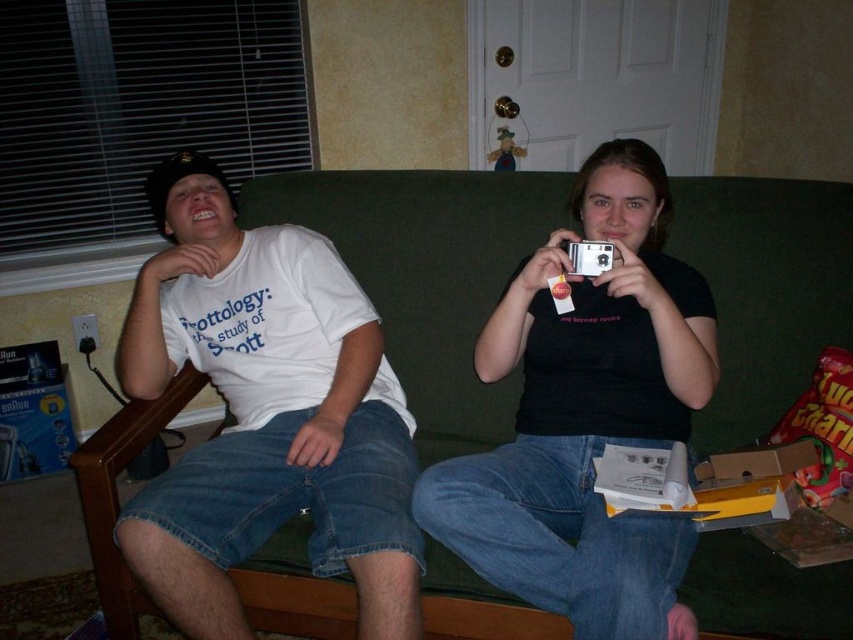
Is green fabric couch at center positioned in front of white matte t-shirt at left?

No, it is behind white matte t-shirt at left.

Between green fabric couch at center and white matte t-shirt at left, which one appears on the left side from the viewer's perspective?

white matte t-shirt at left is more to the left.

This screenshot has height=640, width=853. What do you see at coordinates (427, 275) in the screenshot? I see `green fabric couch at center` at bounding box center [427, 275].

Identify the location of green fabric couch at center. The image size is (853, 640). (427, 275).

Can you confirm if green fabric couch at center is wider than black matte camera at center?

Yes.

Is green fabric couch at center smaller than black matte camera at center?

Indeed, green fabric couch at center has a smaller size compared to black matte camera at center.

Is point (434, 227) farther from viewer compared to point (498, 460)?

Yes, point (434, 227) is farther from viewer.

Where is `green fabric couch at center`? This screenshot has width=853, height=640. green fabric couch at center is located at coordinates (x=427, y=275).

Is white matte t-shirt at left taller than black matte camera at center?

Yes, white matte t-shirt at left is taller than black matte camera at center.

Between white matte t-shirt at left and black matte camera at center, which one appears on the right side from the viewer's perspective?

Positioned to the right is black matte camera at center.

Is point (408, 445) positioned before point (508, 291)?

Yes, point (408, 445) is in front of point (508, 291).

Where is `white matte t-shirt at left`? This screenshot has width=853, height=640. white matte t-shirt at left is located at coordinates (265, 413).